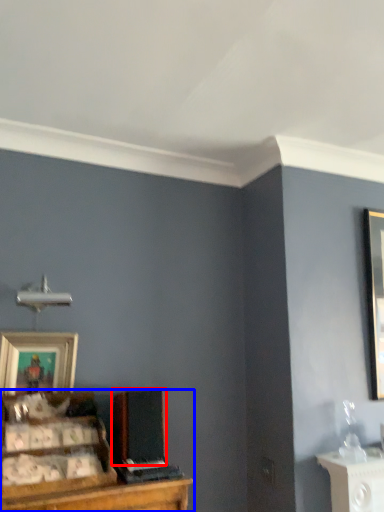
Question: Which object is further to the camera taking this photo, speaker (highlighted by a red box) or entertainment center (highlighted by a blue box)?

Choices:
 (A) speaker
 (B) entertainment center

Answer: (A)